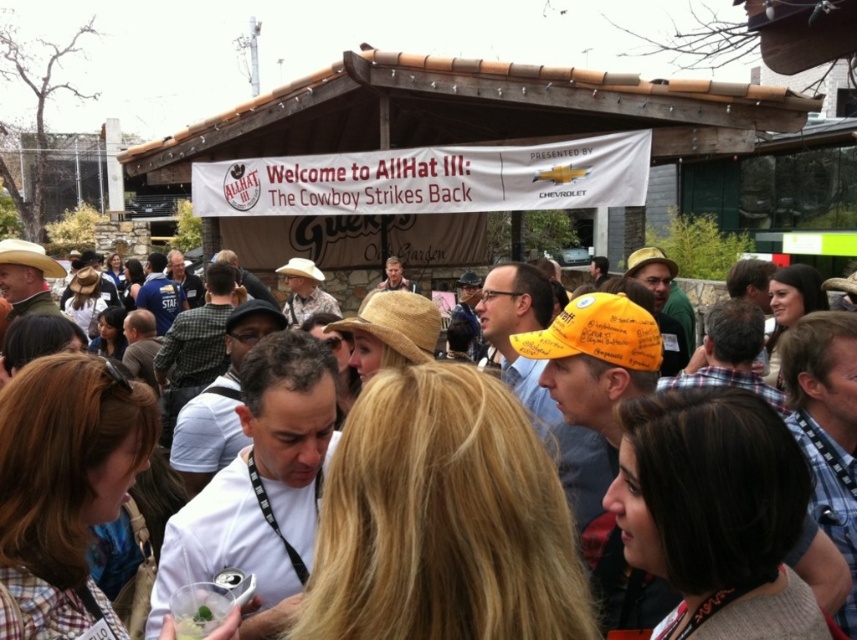
Who is taller, natural straw cowboy hat at center or brown straw hat at center?

With more height is brown straw hat at center.

Between natural straw cowboy hat at center and brown straw hat at center, which one appears on the right side from the viewer's perspective?

Positioned to the right is natural straw cowboy hat at center.

Does point (388, 346) come behind point (848, 579)?

That is True.

Locate an element on the screen. The height and width of the screenshot is (640, 857). natural straw cowboy hat at center is located at coordinates (397, 323).